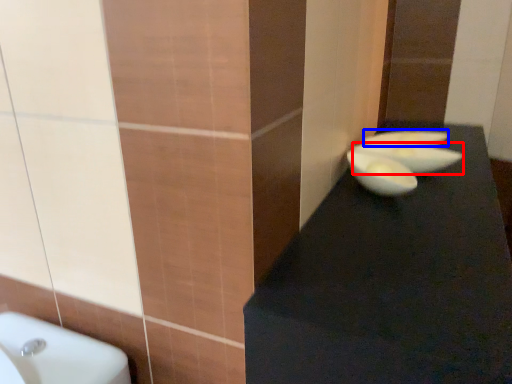
Question: Which point is further to the camera, basin (highlighted by a red box) or basin (highlighted by a blue box)?

Choices:
 (A) basin
 (B) basin

Answer: (B)